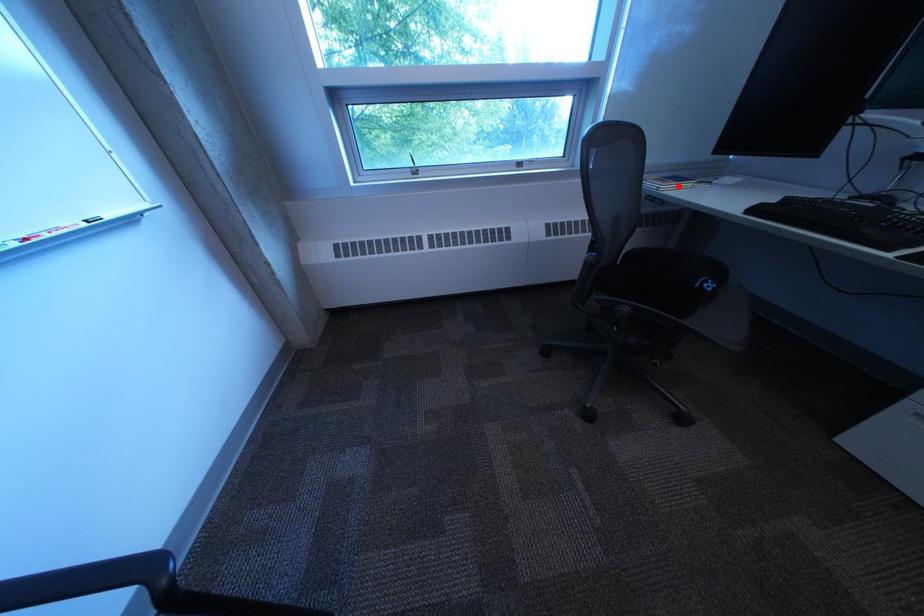
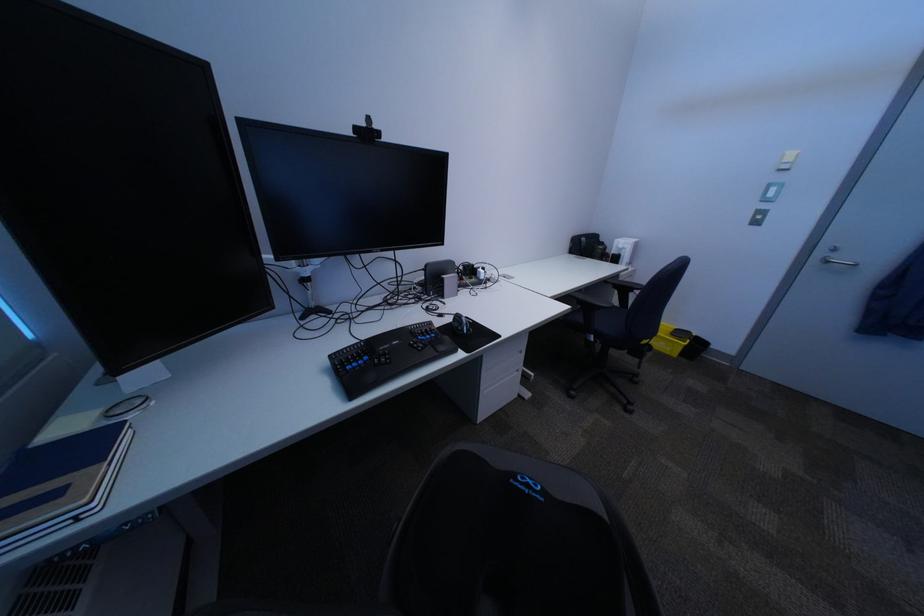
Locate, in the second image, the point that corresponds to the highlighted location in the first image.

(101, 503)